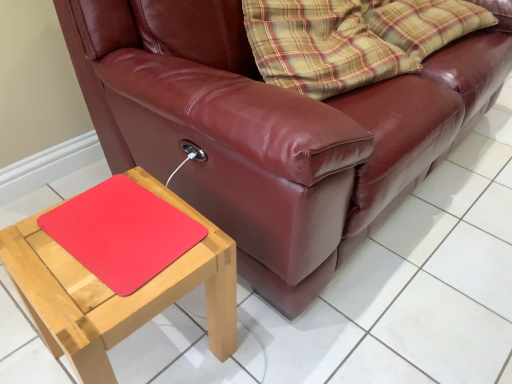
Identify the location of vacant region below natural wood table at lower left (from a real-world perspective). This screenshot has height=384, width=512. (161, 345).